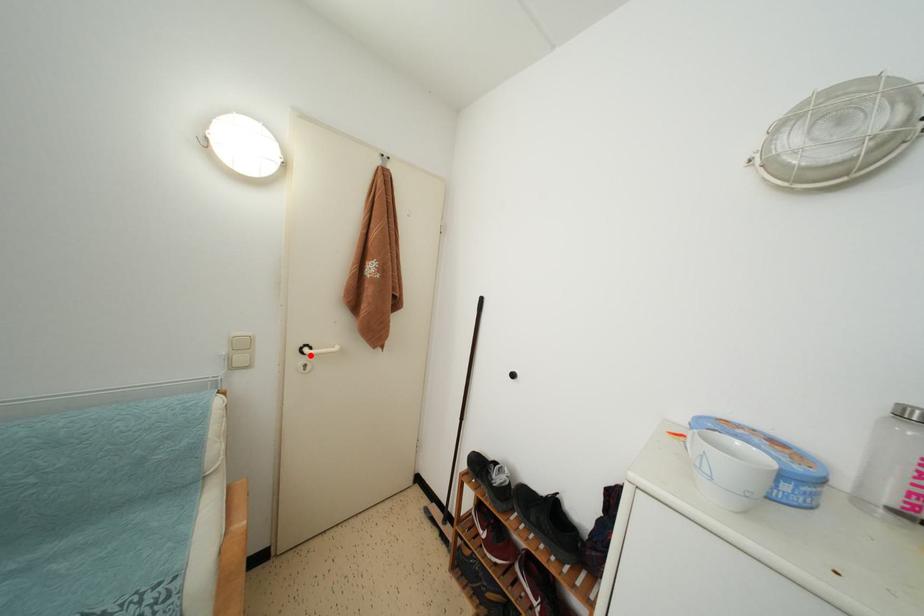
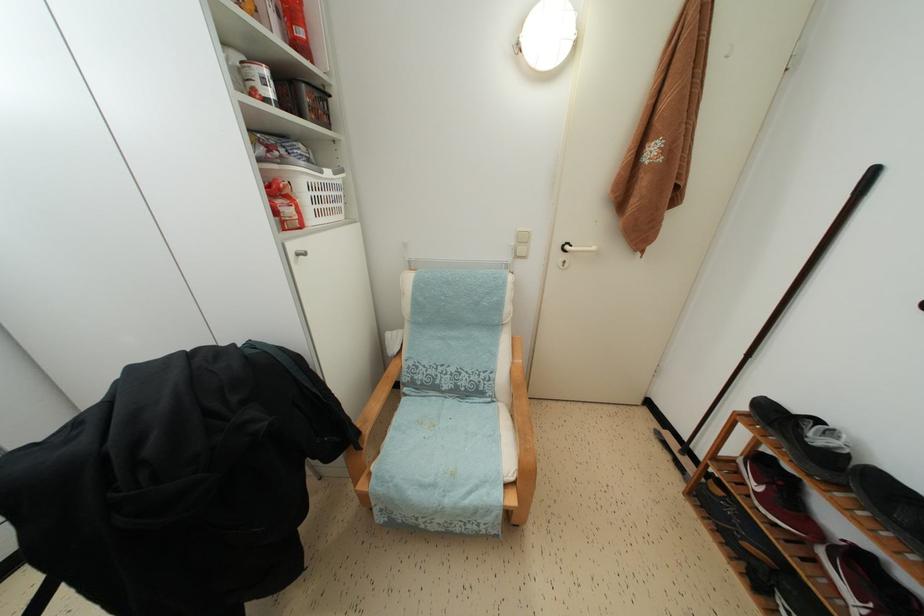
Find the pixel in the second image that matches the highlighted location in the first image.

(572, 253)